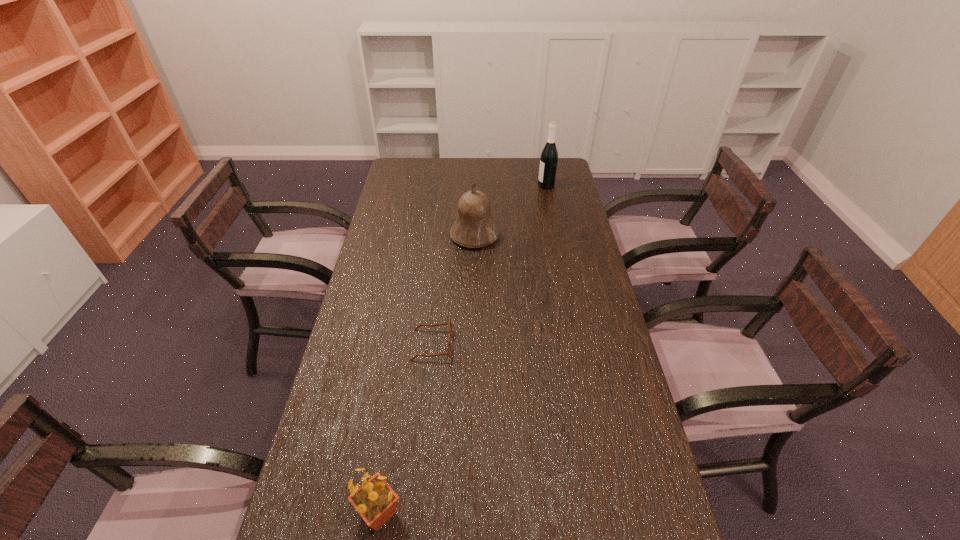
You are a GUI agent. You are given a task and a screenshot of the screen. Output one action in this format:
    pyautogui.click(x=<x>, y=<y>)
    Task: Click on the object that is at the far edge
    The image size is (960, 540).
    Given the screenshot: What is the action you would take?
    pyautogui.click(x=549, y=156)

Locate an element on the screen. This screenshot has height=540, width=960. object that is at the right edge is located at coordinates (549, 156).

Find the location of a particular element. The width and height of the screenshot is (960, 540). object that is at the far right corner is located at coordinates point(549,156).

This screenshot has height=540, width=960. In the image, there is a desktop. What are the coordinates of `vacant space at the far edge` in the screenshot? It's located at (445, 181).

Where is `vacant space at the left edge of the desktop`? The image size is (960, 540). vacant space at the left edge of the desktop is located at coordinates (404, 224).

The height and width of the screenshot is (540, 960). I want to click on vacant space at the right edge of the desktop, so click(618, 454).

The image size is (960, 540). In the image, there is a desktop. What are the coordinates of `vacant space at the far left corner` in the screenshot? It's located at (397, 173).

Find the location of `free space that is in between the spectacles and the farthest object`. free space that is in between the spectacles and the farthest object is located at coordinates (490, 265).

The height and width of the screenshot is (540, 960). What are the coordinates of `vacant area between the rightmost object and the second farthest object` in the screenshot? It's located at (511, 211).

The image size is (960, 540). I want to click on vacant area that lies between the third farthest object and the tallest object, so click(490, 265).